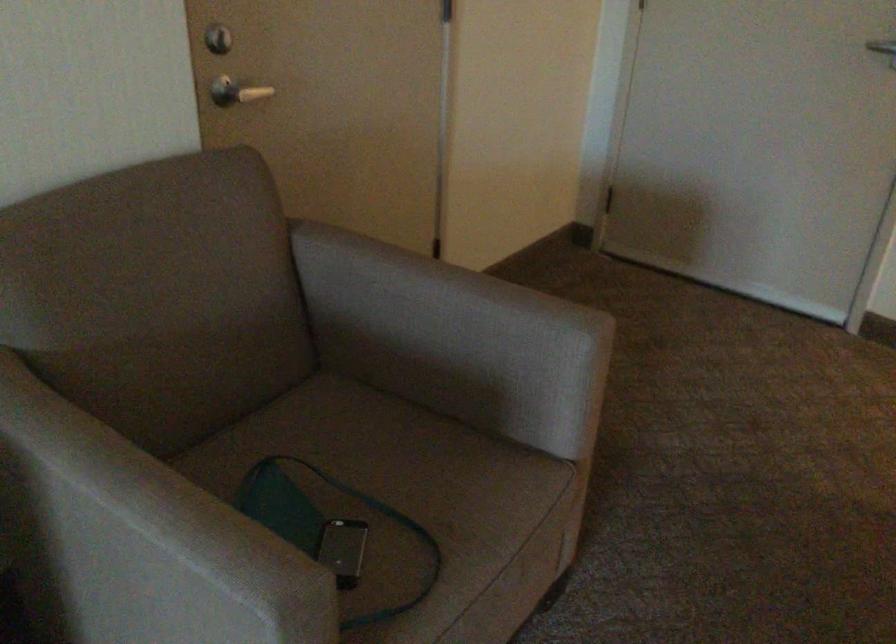
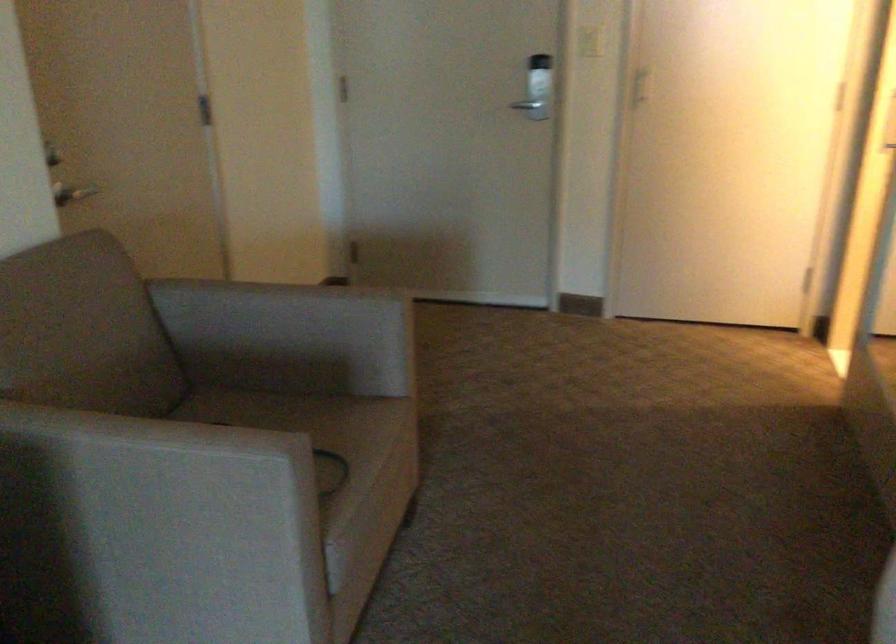
What movement of the cameraman would produce the second image?

The movement direction of the cameraman is left, backward.